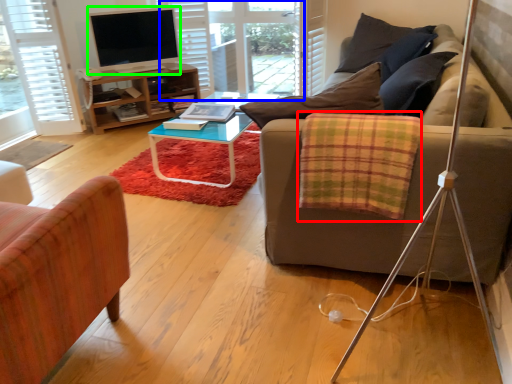
Question: Estimate the real-world distances between objects in this image. Which object is closer to blanket (highlighted by a red box), glass door (highlighted by a blue box) or television (highlighted by a green box)?

Choices:
 (A) glass door
 (B) television

Answer: (B)